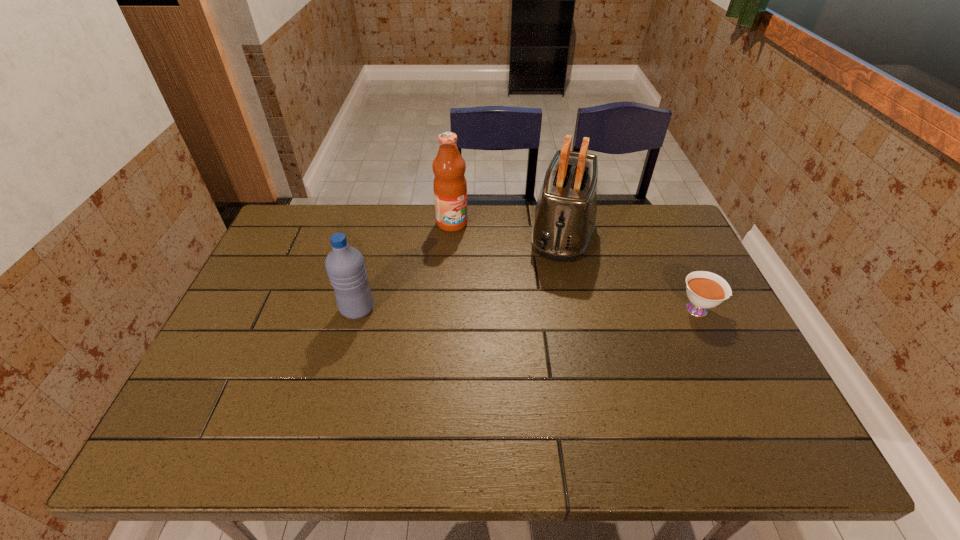
The width and height of the screenshot is (960, 540). Identify the location of vacant space in between the second object from left to right and the teacup. (576, 266).

At what (x,y) coordinates should I click in order to perform the action: click on blank region between the rightmost object and the toaster. Please return your answer as a coordinate pair (x, y). The width and height of the screenshot is (960, 540). Looking at the image, I should click on click(631, 272).

You are a GUI agent. You are given a task and a screenshot of the screen. Output one action in this format:
    pyautogui.click(x=<x>, y=<y>)
    Task: Click on the object that stands as the second closest to the third object from right to left
    
    Given the screenshot: What is the action you would take?
    pyautogui.click(x=345, y=266)

Locate which object is the third closest to the third object from left to right. Please provide its 2D coordinates. Your answer should be formatted as a tuple, i.e. [(x, y)], where the tuple contains the x and y coordinates of a point satisfying the conditions above.

[(345, 266)]

Image resolution: width=960 pixels, height=540 pixels. Find the location of `free space that satisfies the following two spatial constraints: 1. on the front side of the rightmost object; 2. on the side of the leftmost object with the handle`. free space that satisfies the following two spatial constraints: 1. on the front side of the rightmost object; 2. on the side of the leftmost object with the handle is located at coordinates (357, 309).

The image size is (960, 540). Find the location of `free location that satisfies the following two spatial constraints: 1. on the front side of the toaster; 2. on the left side of the fruit juice`. free location that satisfies the following two spatial constraints: 1. on the front side of the toaster; 2. on the left side of the fruit juice is located at coordinates (451, 234).

Image resolution: width=960 pixels, height=540 pixels. Identify the location of free location that satisfies the following two spatial constraints: 1. on the back side of the fruit juice; 2. on the left side of the leftmost object. (380, 223).